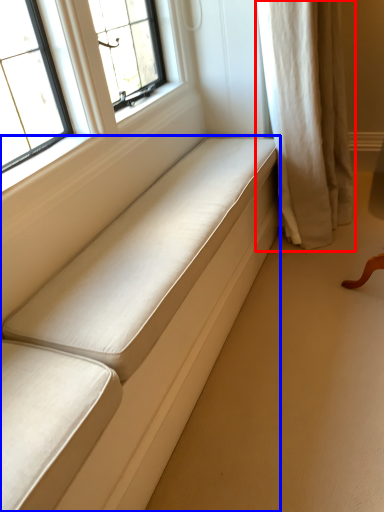
Question: Which of the following is the closest to the observer, curtain (highlighted by a red box) or furniture (highlighted by a blue box)?

Choices:
 (A) curtain
 (B) furniture

Answer: (B)